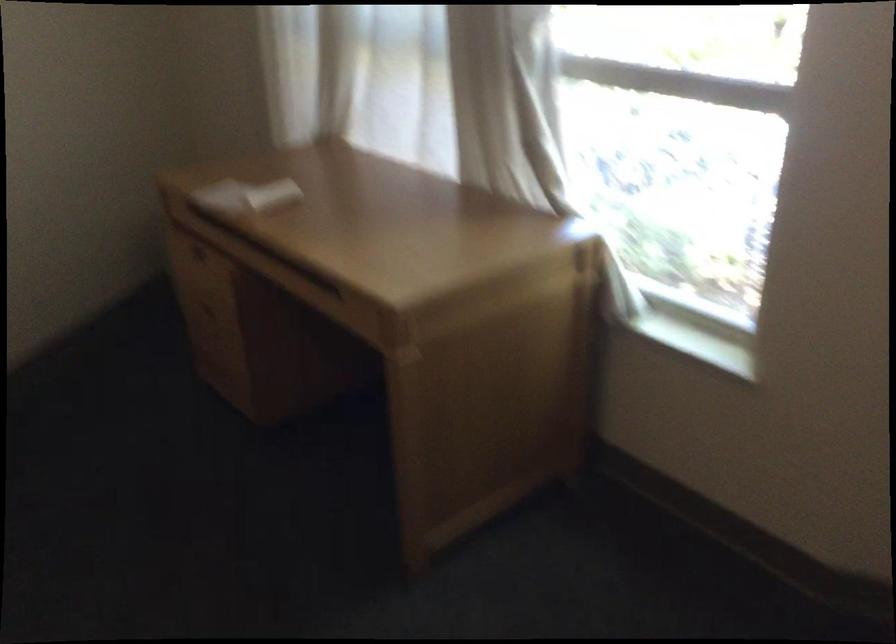
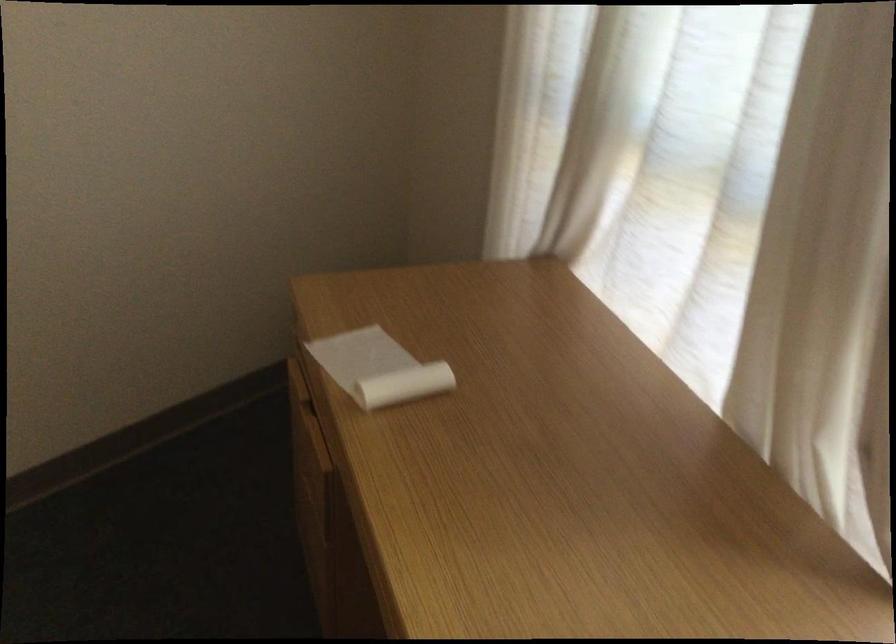
Question: Which direction would the cameraman need to move to produce the second image? Reply with the corresponding letter.

Choices:
 (A) Left
 (B) Right
 (C) Forward
 (D) Backward

Answer: (C)